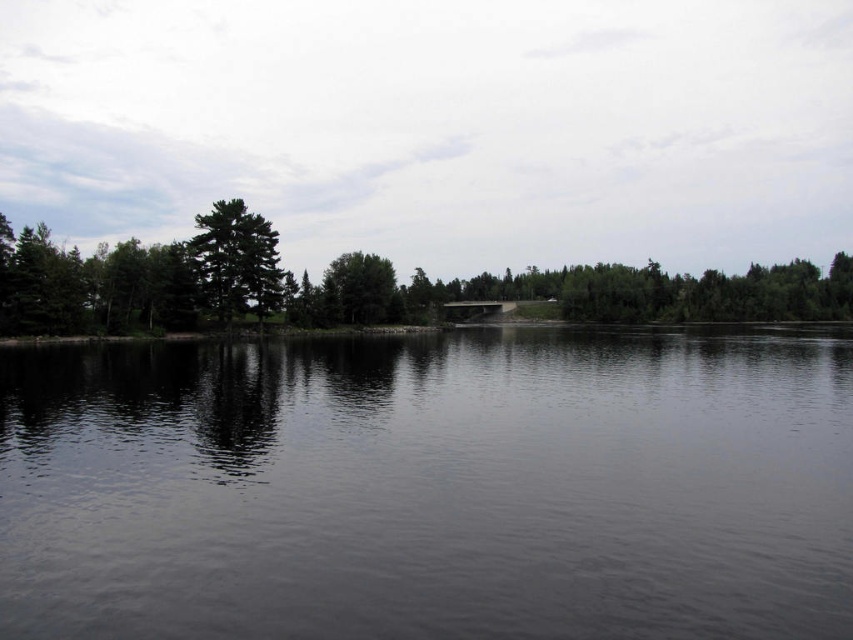
Between dark reflective water at center and green matte tree at left, which one appears on the right side from the viewer's perspective?

Positioned to the right is dark reflective water at center.

Is dark reflective water at center to the left of green matte tree at left from the viewer's perspective?

In fact, dark reflective water at center is to the right of green matte tree at left.

The width and height of the screenshot is (853, 640). I want to click on dark reflective water at center, so click(428, 488).

Locate an element on the screen. Image resolution: width=853 pixels, height=640 pixels. dark reflective water at center is located at coordinates (428, 488).

Is dark reflective water at center further to camera compared to green matte tree at center?

That is False.

Can you confirm if dark reflective water at center is positioned below green matte tree at center?

Yes.

Is point (511, 600) positioned before point (749, 301)?

Yes.

Locate an element on the screen. dark reflective water at center is located at coordinates (428, 488).

Does green matte tree at center have a greater width compared to green matte tree at left?

Correct, the width of green matte tree at center exceeds that of green matte tree at left.

Looking at this image, is green matte tree at center taller than green matte tree at left?

Indeed, green matte tree at center has a greater height compared to green matte tree at left.

Is point (134, 273) positioned behind point (230, 221)?

No, it is not.

Where is `green matte tree at center`? This screenshot has width=853, height=640. green matte tree at center is located at coordinates click(x=358, y=285).